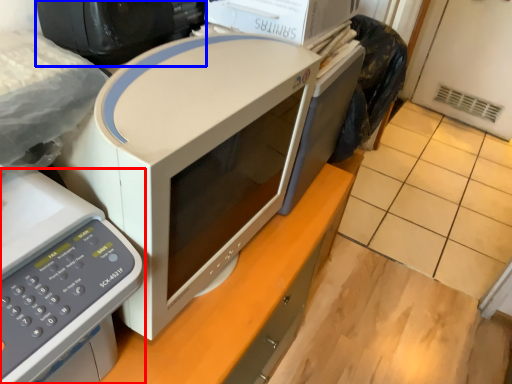
Question: Which point is closer to the camera, home appliance (highlighted by a red box) or desktop computer (highlighted by a blue box)?

Choices:
 (A) home appliance
 (B) desktop computer

Answer: (A)